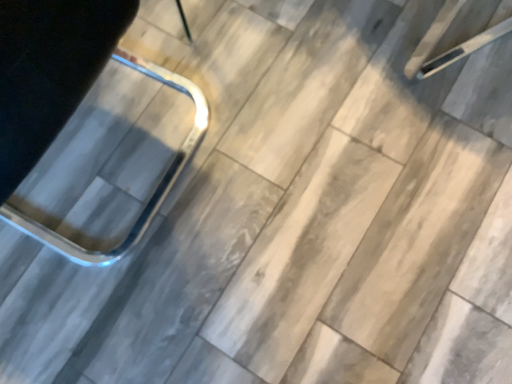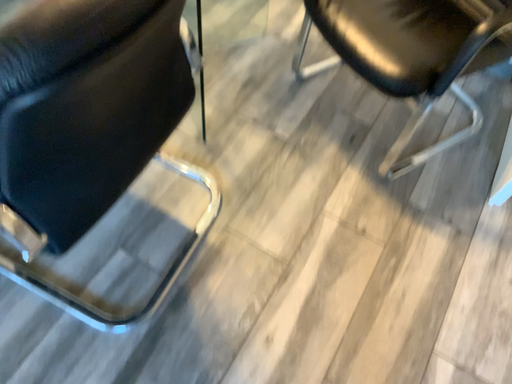
Question: Which way did the camera rotate in the video?

Choices:
 (A) rotated right
 (B) rotated left

Answer: (A)